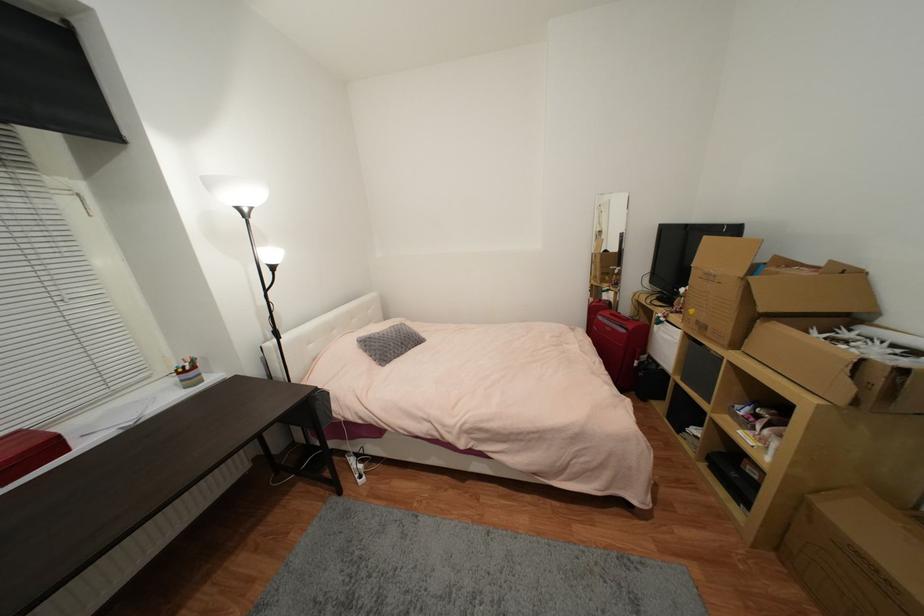
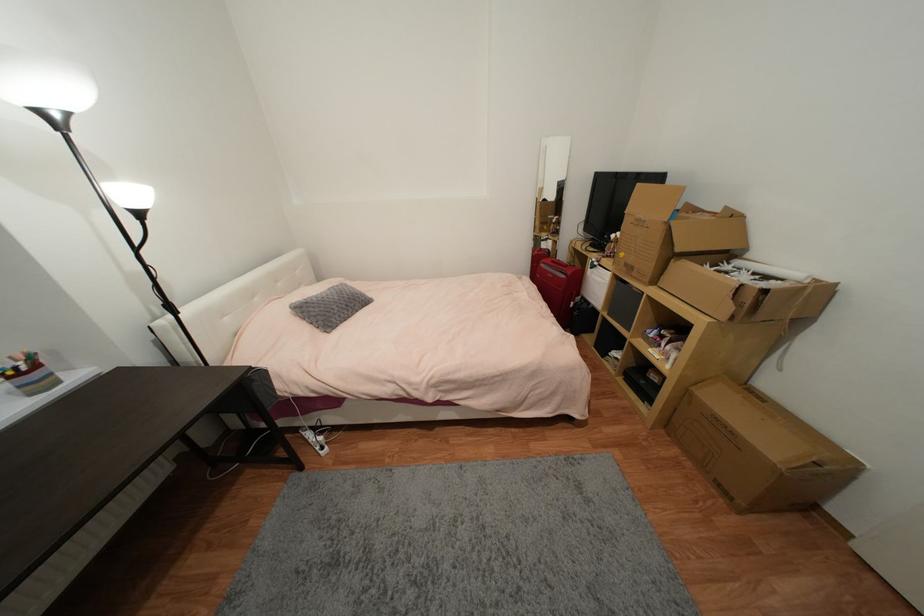
Which direction would the cameraman need to move to produce the second image?

The movement direction of the cameraman is left, forward.